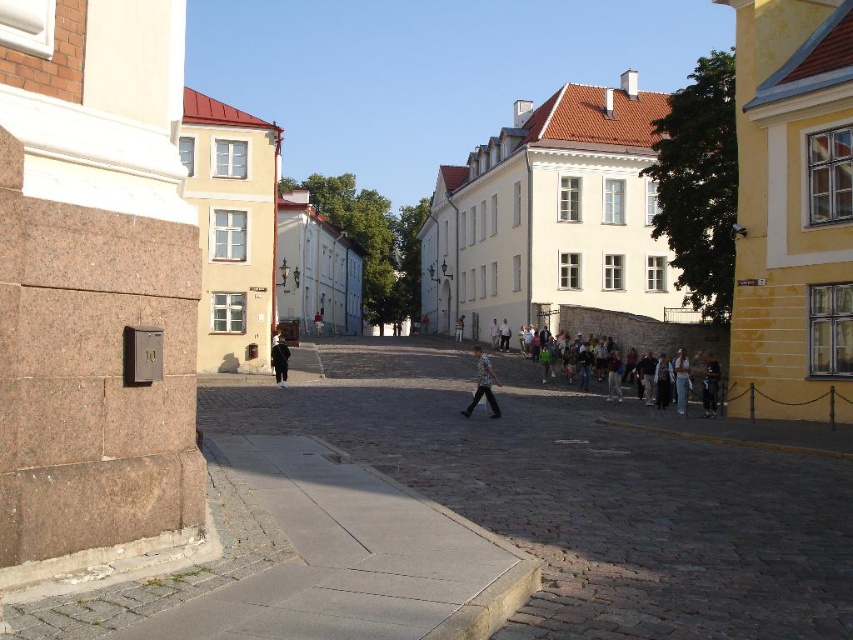
Question: Which point is farther to the camera?

Choices:
 (A) black matte jacket at center
 (B) striped shirt at center

Answer: (A)

Question: Is striped shirt at center thinner than black matte jacket at center?

Choices:
 (A) no
 (B) yes

Answer: (A)

Question: From the image, what is the correct spatial relationship of striped shirt at center in relation to black matte jacket at center?

Choices:
 (A) right
 (B) left

Answer: (A)

Question: Which point is farther from the camera taking this photo?

Choices:
 (A) (480, 387)
 (B) (271, 365)

Answer: (B)

Question: Which point is farther to the camera?

Choices:
 (A) black matte jacket at center
 (B) striped shirt at center

Answer: (A)

Question: Is striped shirt at center further to camera compared to black matte jacket at center?

Choices:
 (A) no
 (B) yes

Answer: (A)